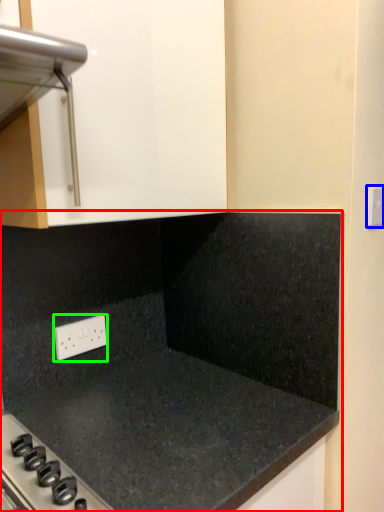
Question: Based on their relative distances, which object is farther from countertop (highlighted by a red box)? Choose from electric outlet (highlighted by a blue box) and electric outlet (highlighted by a green box).

Choices:
 (A) electric outlet
 (B) electric outlet

Answer: (A)